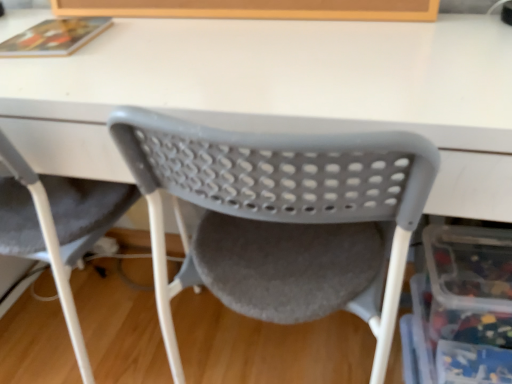
This screenshot has width=512, height=384. Identify the location of free region under matte plastic chair at center, the first chair positioned from the right (from a real-world perspective). (284, 349).